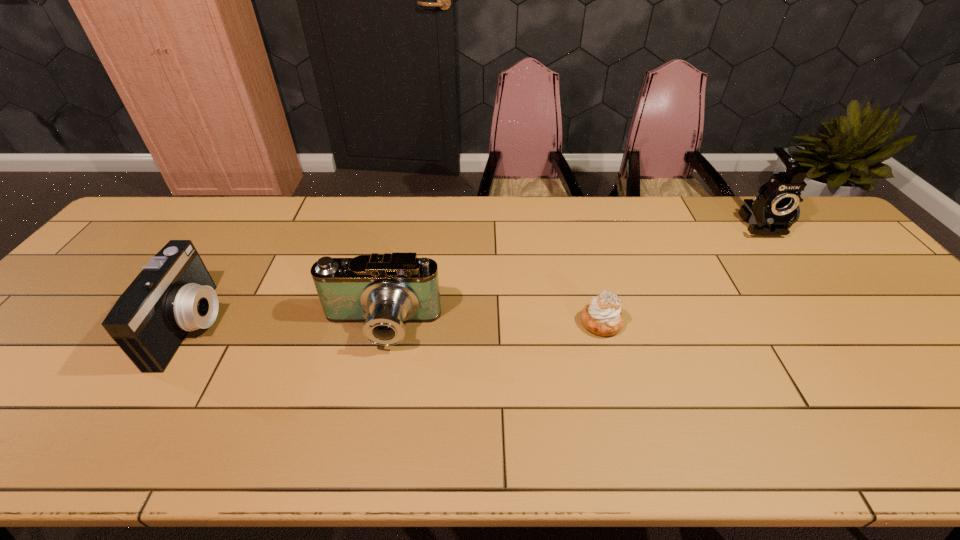
You are a GUI agent. You are given a task and a screenshot of the screen. Output one action in this format:
    pyautogui.click(x=<x>, y=<y>)
    Task: Click on the free point that satisfies the following two spatial constraints: 1. on the lens mount of the farthest camcorder; 2. on the lens of the leftmost camcorder
    The width and height of the screenshot is (960, 540).
    Given the screenshot: What is the action you would take?
    pyautogui.click(x=842, y=326)